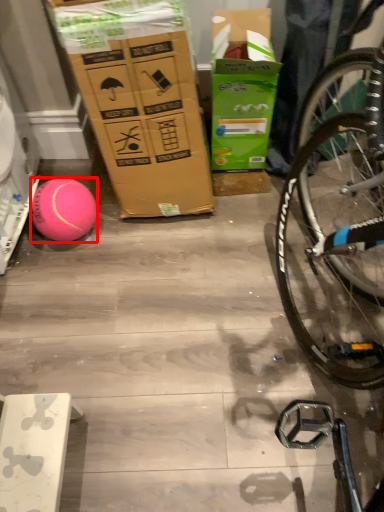
Question: Where is ball (annotated by the red box) located in relation to cardboard box in the image?

Choices:
 (A) left
 (B) right

Answer: (A)